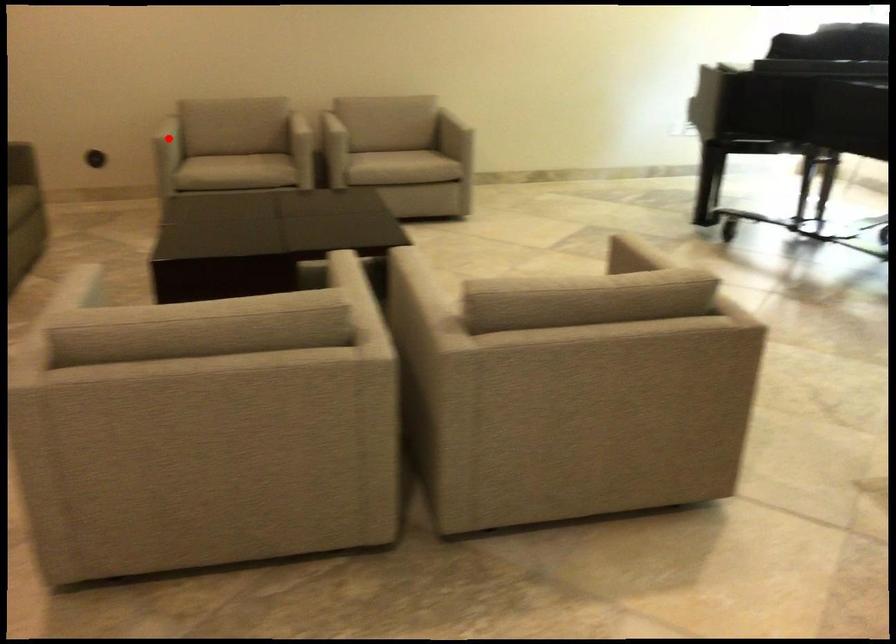
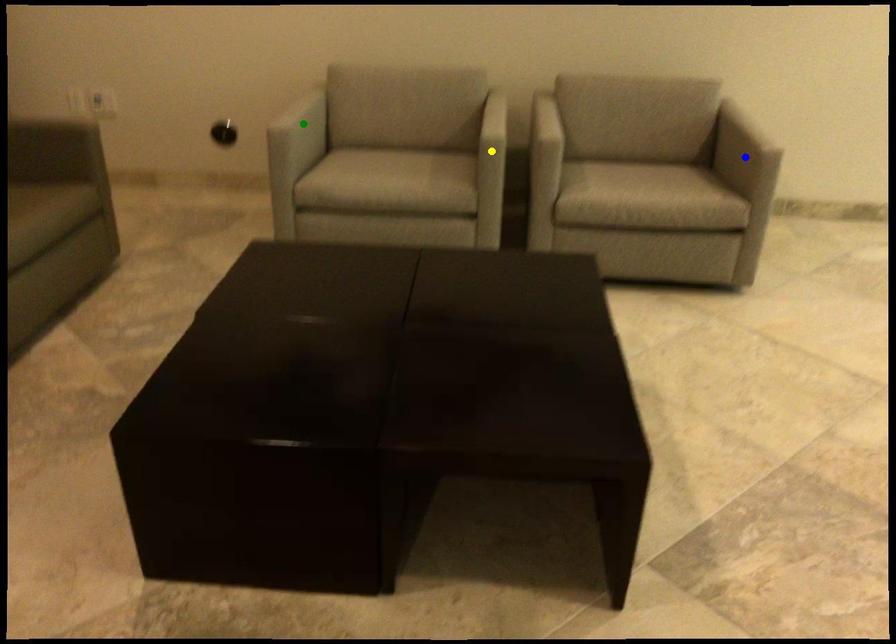
Question: I am providing you with two images of the same scene from different viewpoints. A red point is marked on the first image. You are given multiple points on the second image. Which point in image 2 is actually the same real-world point as the red point in image 1?

Choices:
 (A) green point
 (B) blue point
 (C) yellow point

Answer: (A)